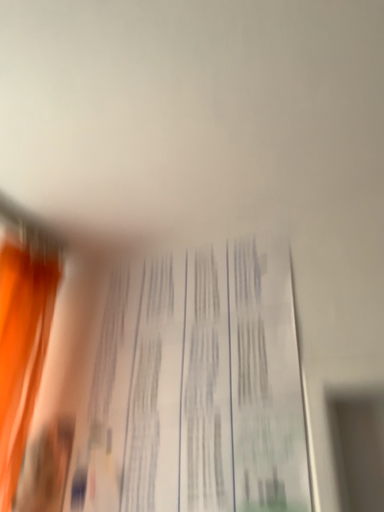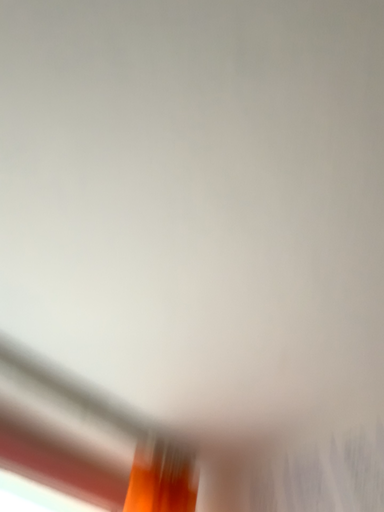
Question: How did the camera likely rotate when shooting the video?

Choices:
 (A) rotated upward
 (B) rotated downward

Answer: (A)